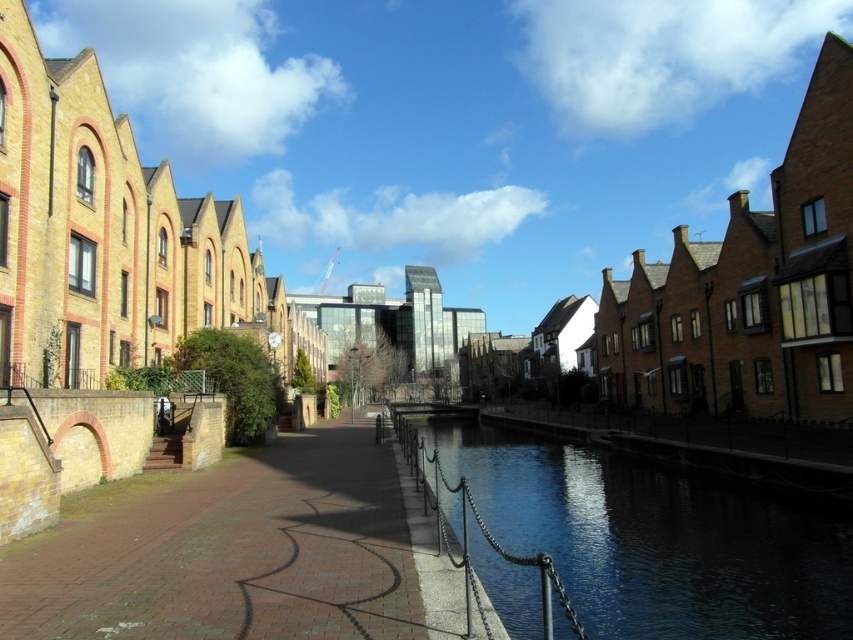
You are a tourist standing on the brick pavement at center and want to take a photo of the dark glassy water at center. Since you only have a wide angle lens, which direction should you move to get a better view of the entire canal?

You should move to the left side of the brick pavement at center to get a better view of the entire canal because the brick pavement at center is positioned on the left side of the dark glassy water at center, so moving left would place you further away from the water and allow the lens to capture more of it.

You are standing on the brick pavement at center and want to look down at the dark glassy water at center. Is the water directly below you or to the side?

The brick pavement at center is positioned over dark glassy water at center, so the water is directly below you.

Looking at this image, you are a delivery person carrying a package and need to cross the canal. You see the brick pavement at center and the dark glassy water at center. Which path is wider for you to choose?

The brick pavement at center is narrower than the dark glassy water at center, so you should choose the dark glassy water at center as it is wider.